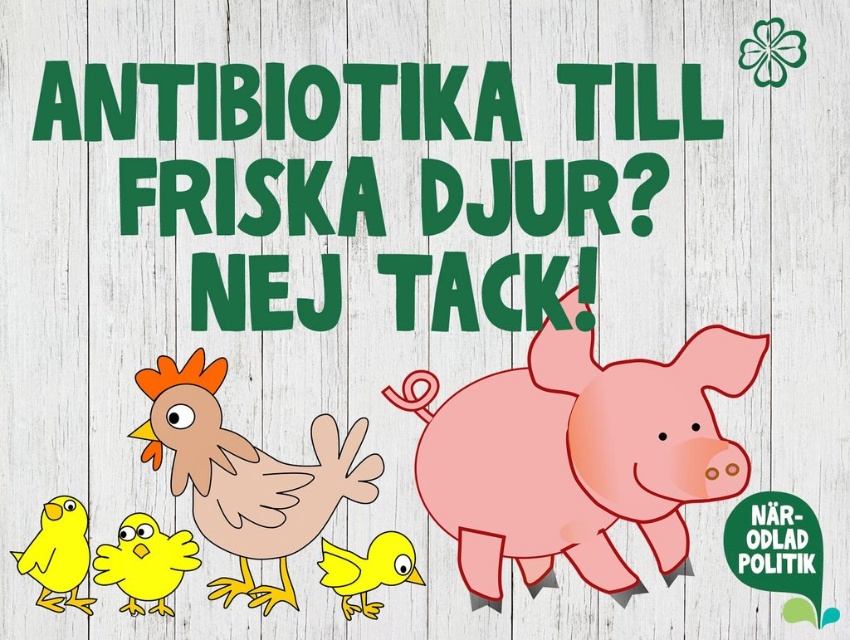
Based on the scene description, where is the pink matte pig at center located in terms of coordinates?

The pink matte pig at center is located at coordinates point (578, 454).

You are a farmer who wants to place a small fence between the pink matte pig at center and the brown matte chicken at center. Since the pig is taller, will the fence need to be higher to keep both animals contained?

The pink matte pig at center is taller than the brown matte chicken at center, so the fence should be at least as tall as the pig to contain both animals properly.